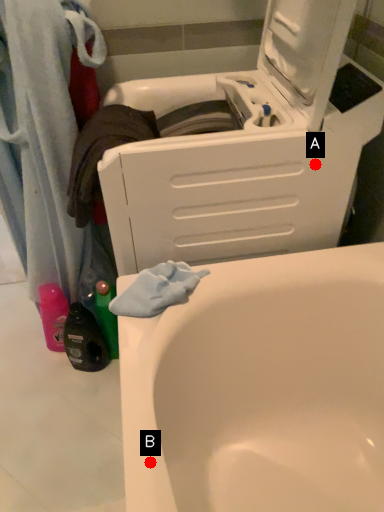
Question: Two points are circled on the image, labeled by A and B beside each circle. Which point appears farthest from the camera in this image?

Choices:
 (A) A is further
 (B) B is further

Answer: (A)